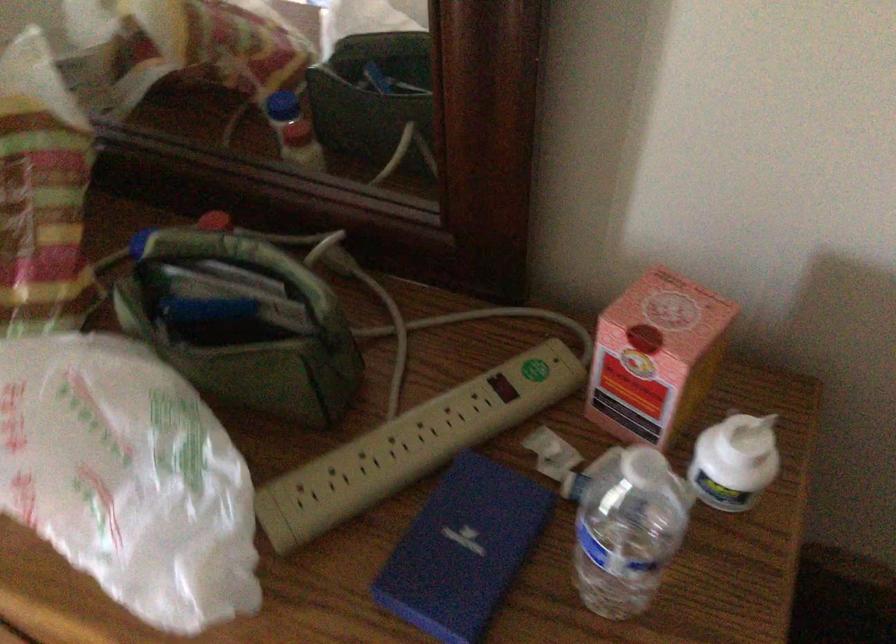
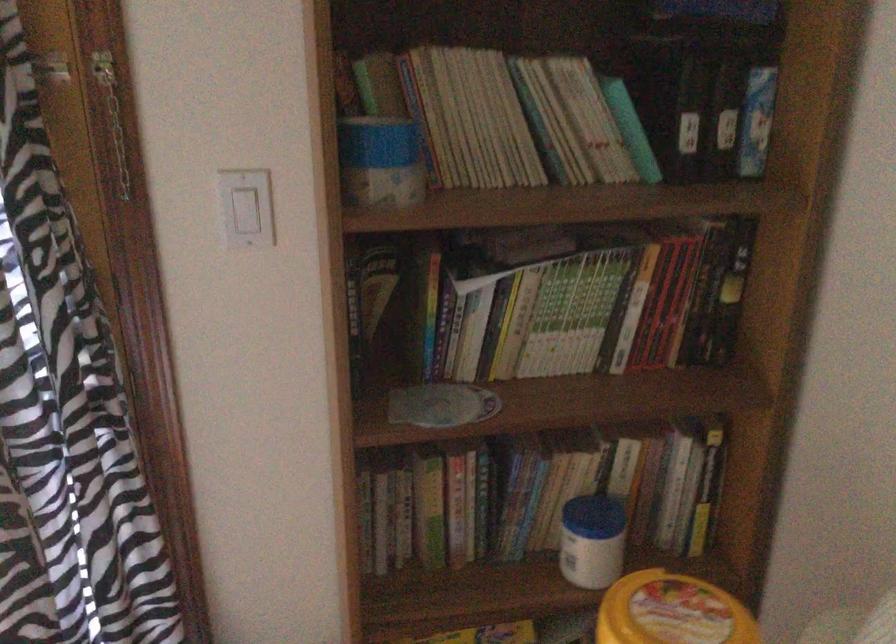
Question: Based on the continuous images, in which direction is the camera rotating? Reply with the corresponding letter.

Choices:
 (A) Left
 (B) Right
 (C) Up
 (D) Down

Answer: (A)